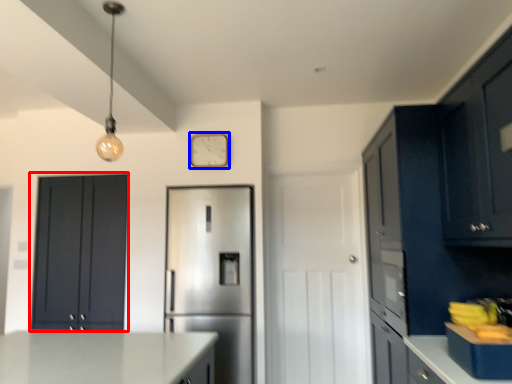
Question: Which of the following is the farthest to the observer, cabinetry (highlighted by a red box) or clock (highlighted by a blue box)?

Choices:
 (A) cabinetry
 (B) clock

Answer: (B)